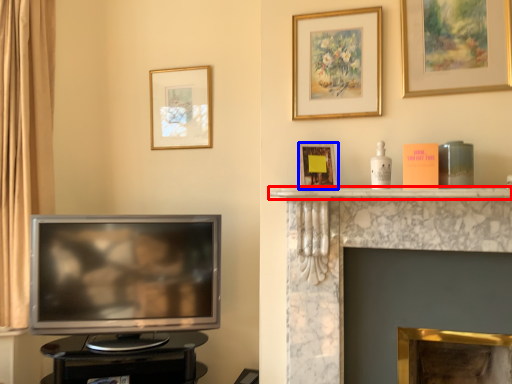
Question: Which object is further to the camera taking this photo, mantle (highlighted by a red box) or picture frame (highlighted by a blue box)?

Choices:
 (A) mantle
 (B) picture frame

Answer: (B)